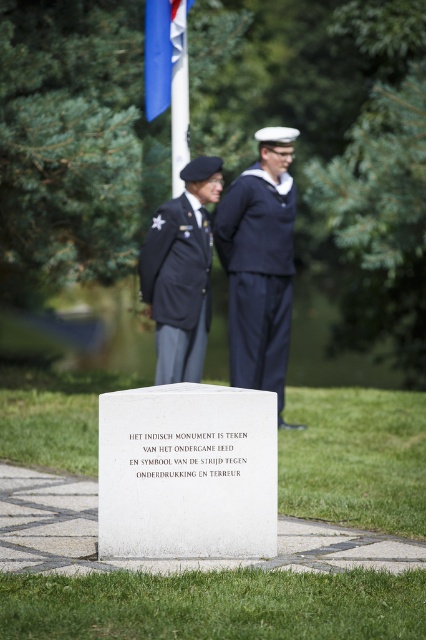
Question: Can you confirm if navy blue fabric sailor suit at center is positioned above blue fabric flag at upper center?

Choices:
 (A) no
 (B) yes

Answer: (A)

Question: Does navy blue fabric sailor suit at center lie behind dark blue fabric uniform at center?

Choices:
 (A) yes
 (B) no

Answer: (A)

Question: Which is farther from the navy blue fabric sailor suit at center?

Choices:
 (A) blue fabric flag at upper center
 (B) dark blue fabric uniform at center

Answer: (A)

Question: Among these points, which one is nearest to the camera?

Choices:
 (A) (253, 246)
 (B) (204, 218)
 (C) (155, 49)

Answer: (B)

Question: Can you confirm if navy blue fabric sailor suit at center is smaller than dark blue fabric uniform at center?

Choices:
 (A) yes
 (B) no

Answer: (B)

Question: Considering the real-world distances, which object is closest to the dark blue fabric uniform at center?

Choices:
 (A) navy blue fabric sailor suit at center
 (B) blue fabric flag at upper center

Answer: (A)